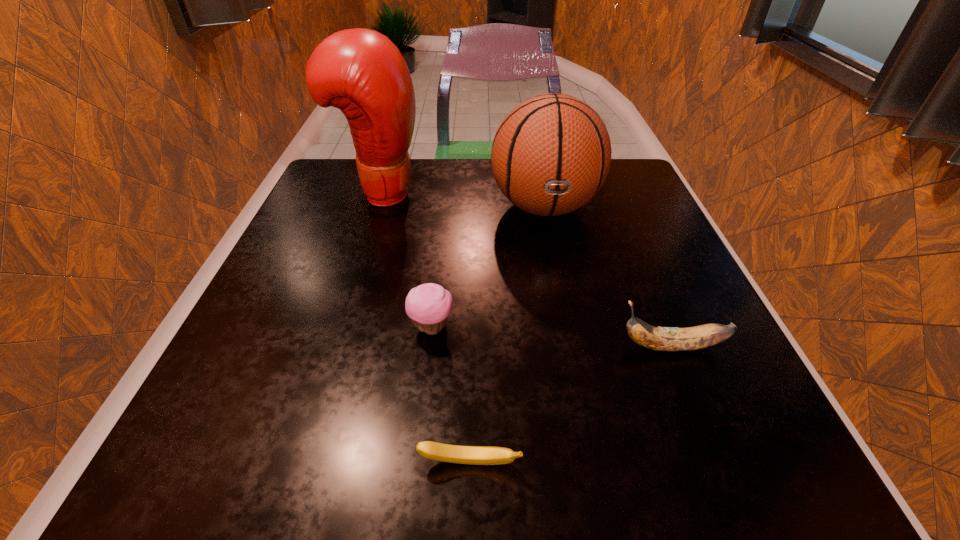
At what (x,y) coordinates should I click in order to perform the action: click on the leftmost object. Please return your answer as a coordinate pair (x, y). The image size is (960, 540). Looking at the image, I should click on (360, 71).

Image resolution: width=960 pixels, height=540 pixels. I want to click on boxing glove, so click(x=360, y=71).

The image size is (960, 540). Find the location of `basketball`. basketball is located at coordinates (551, 154).

Find the location of a particular element. the taller banana is located at coordinates (668, 339).

I want to click on the farther banana, so click(668, 339).

Find the location of `cupcake`. cupcake is located at coordinates (428, 305).

In order to click on the left banana in this screenshot , I will do `click(476, 455)`.

I want to click on the nearest object, so click(476, 455).

Locate an element on the screen. The height and width of the screenshot is (540, 960). vacant point located on the striking surface of the tallest object is located at coordinates (584, 192).

What are the coordinates of `vacant area situated 0.060m on the side where the inflation valve is located` in the screenshot? It's located at (555, 259).